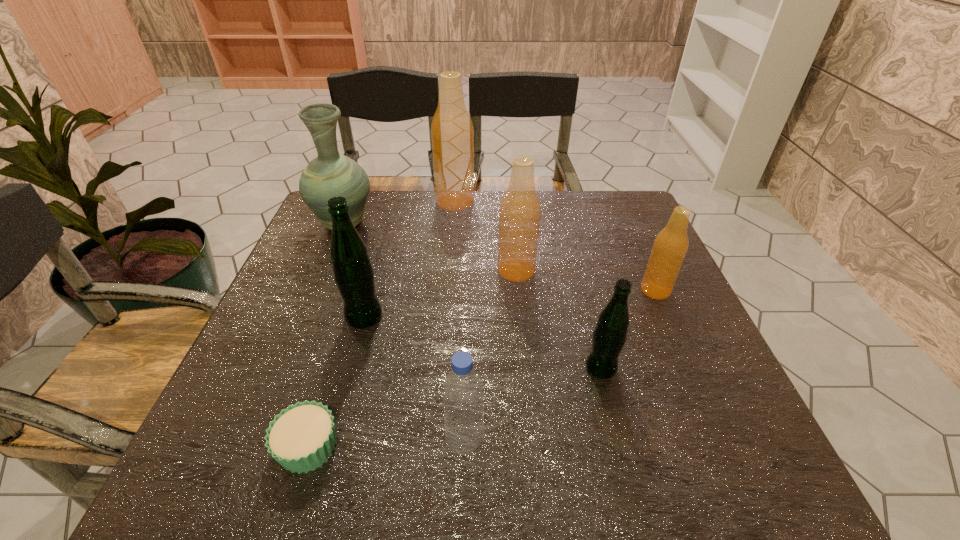
Locate an element on the screen. The image size is (960, 540). the leftmost tan beer bottle is located at coordinates (452, 134).

This screenshot has width=960, height=540. I want to click on the second beer bottle from left to right, so click(x=452, y=134).

Identify the location of pitcher. (331, 174).

Image resolution: width=960 pixels, height=540 pixels. I want to click on the second tan beer bottle from right to left, so click(520, 209).

Image resolution: width=960 pixels, height=540 pixels. Identify the location of the sixth object from left to right. (520, 209).

Locate an element on the screen. the bigger green beer bottle is located at coordinates (353, 273).

Locate an element on the screen. the farther green beer bottle is located at coordinates (353, 273).

At what (x,y) coordinates should I click in order to perform the action: click on the sixth farthest object. Please return your answer as a coordinate pair (x, y). Looking at the image, I should click on (609, 336).

The height and width of the screenshot is (540, 960). Find the location of `the seventh object from left to right`. the seventh object from left to right is located at coordinates 609,336.

Where is `the smallest tan beer bottle`? This screenshot has width=960, height=540. the smallest tan beer bottle is located at coordinates (670, 246).